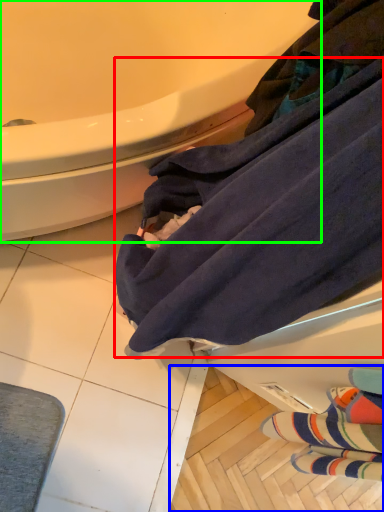
Question: Considering the real-world distances, which object is farthest from bath towel (highlighted by a red box)? tile (highlighted by a blue box) or bathtub (highlighted by a green box)?

Choices:
 (A) tile
 (B) bathtub

Answer: (A)